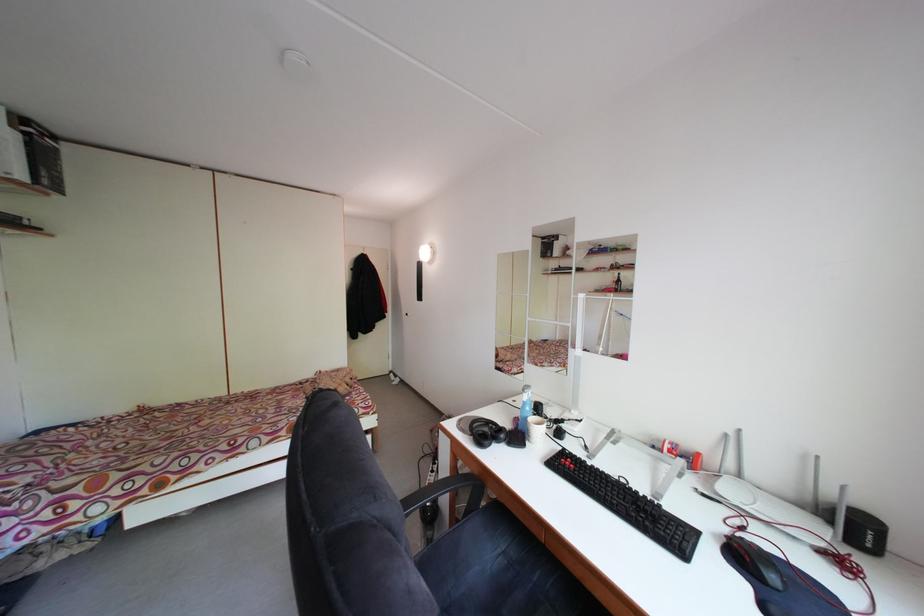
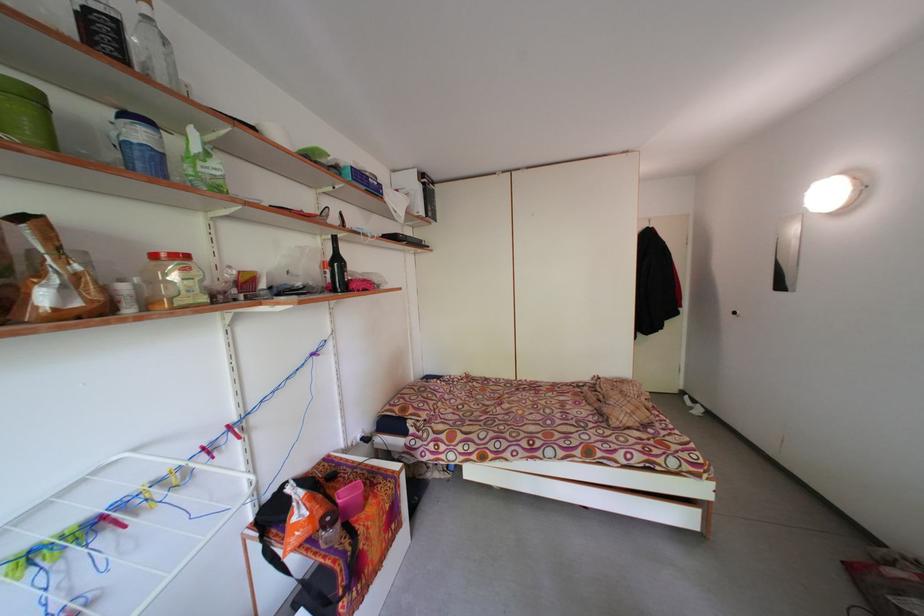
Question: Based on the continuous images, in which direction is the camera rotating? Reply with the corresponding letter.

Choices:
 (A) Left
 (B) Right
 (C) Up
 (D) Down

Answer: (A)